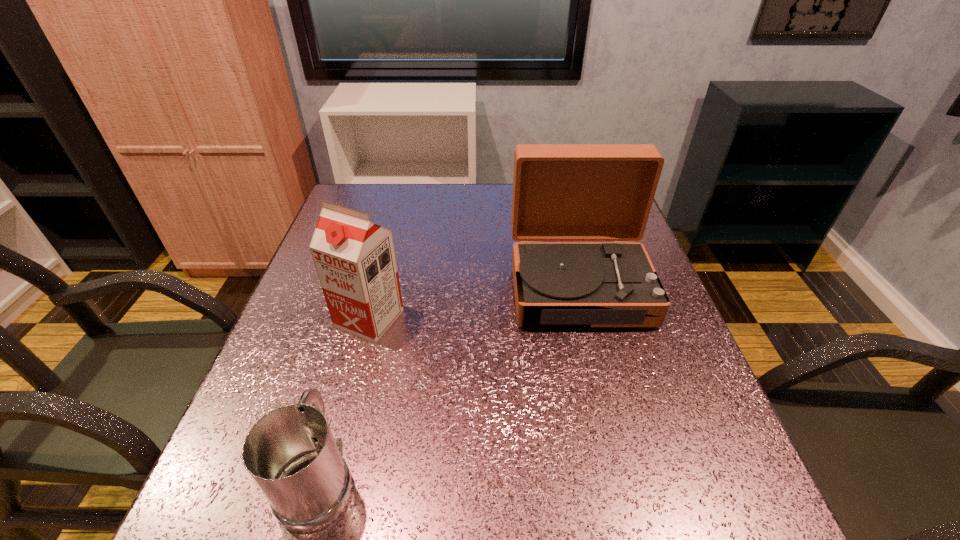
At what (x,y) coordinates should I click in order to perform the action: click on soya milk situated at the left edge. Please return your answer as a coordinate pair (x, y). Looking at the image, I should click on (355, 260).

In order to click on mug that is at the left edge in this screenshot , I will do 290,453.

You are a GUI agent. You are given a task and a screenshot of the screen. Output one action in this format:
    pyautogui.click(x=<x>, y=<y>)
    Task: Click on the object that is at the right edge
    
    Given the screenshot: What is the action you would take?
    pyautogui.click(x=561, y=192)

Find the location of a particular element. The image size is (960, 540). object located at the near left corner is located at coordinates (290, 453).

Locate an element on the screen. This screenshot has width=960, height=540. vacant space at the far edge of the desktop is located at coordinates pos(447,184).

Where is `vacant space at the near edge of the desktop`? The image size is (960, 540). vacant space at the near edge of the desktop is located at coordinates (620, 523).

In the image, there is a desktop. Identify the location of free space at the left edge. (320, 332).

The image size is (960, 540). Find the location of `vacant area at the right edge`. vacant area at the right edge is located at coordinates (637, 411).

Where is `empty location between the soya milk and the phonograph record`? This screenshot has width=960, height=540. empty location between the soya milk and the phonograph record is located at coordinates (474, 303).

Locate an element on the screen. The height and width of the screenshot is (540, 960). free space between the shortest object and the soya milk is located at coordinates (345, 398).